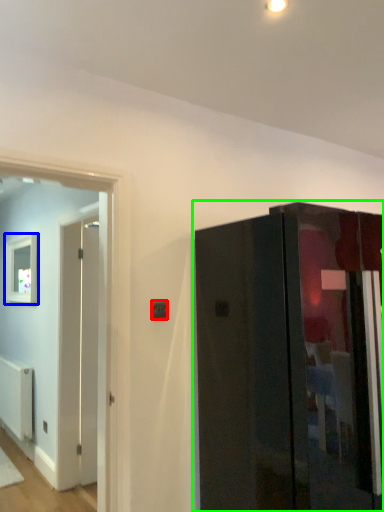
Question: Estimate the real-world distances between objects in this image. Which object is farther from electric outlet (highlighted by a red box), picture frame (highlighted by a blue box) or door (highlighted by a green box)?

Choices:
 (A) picture frame
 (B) door

Answer: (A)